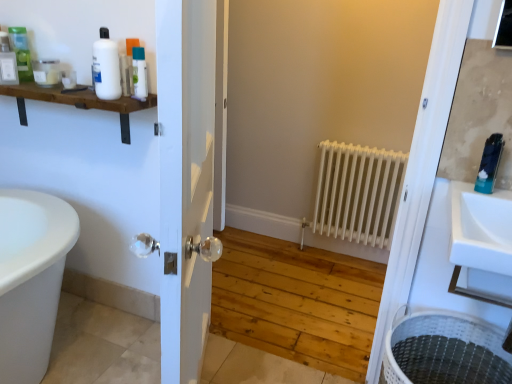
Question: Is matte white jar at upper left, arranged as the 3th toiletry when viewed from the left, positioned with its back to white matte radiator at center?

Choices:
 (A) yes
 (B) no

Answer: (B)

Question: Does matte white jar at upper left, arranged as the 3th toiletry when viewed from the left, appear on the right side of white matte radiator at center?

Choices:
 (A) no
 (B) yes

Answer: (A)

Question: Considering the relative sizes of matte white jar at upper left, which ranks as the 5th toiletry in right-to-left order, and white matte radiator at center in the image provided, is matte white jar at upper left, which ranks as the 5th toiletry in right-to-left order, smaller than white matte radiator at center?

Choices:
 (A) no
 (B) yes

Answer: (B)

Question: Considering the relative sizes of matte white jar at upper left, which ranks as the 5th toiletry in right-to-left order, and white matte radiator at center in the image provided, is matte white jar at upper left, which ranks as the 5th toiletry in right-to-left order, shorter than white matte radiator at center?

Choices:
 (A) yes
 (B) no

Answer: (A)

Question: Is matte white jar at upper left, which ranks as the 5th toiletry in right-to-left order, wider than white matte radiator at center?

Choices:
 (A) no
 (B) yes

Answer: (B)

Question: Is white glossy bottle at upper left, which is the fourth toiletry from right to left, inside the boundaries of matte green bottle at upper left, marked as the second toiletry in a left-to-right arrangement, or outside?

Choices:
 (A) inside
 (B) outside

Answer: (B)

Question: Considering the positions of point (73, 87) and point (24, 41), is point (73, 87) closer or farther from the camera than point (24, 41)?

Choices:
 (A) farther
 (B) closer

Answer: (B)

Question: Is white glossy bottle at upper left, which appears as the 4th toiletry when viewed from the left, wider or thinner than matte green bottle at upper left, which appears as the sixth toiletry when viewed from the right?

Choices:
 (A) wide
 (B) thin

Answer: (B)

Question: Is white glossy bottle at upper left, which appears as the 4th toiletry when viewed from the left, in front of or behind matte green bottle at upper left, which appears as the sixth toiletry when viewed from the right, in the image?

Choices:
 (A) behind
 (B) front

Answer: (B)

Question: Which is correct: white glossy bottle at upper left, which is counted as the third toiletry, starting from the right, is inside white glossy bottle at upper left, which appears as the 4th toiletry when viewed from the left, or outside of it?

Choices:
 (A) inside
 (B) outside

Answer: (B)

Question: Is white glossy bottle at upper left, placed as the fifth toiletry when sorted from left to right, in front of or behind white glossy bottle at upper left, which appears as the 4th toiletry when viewed from the left, in the image?

Choices:
 (A) front
 (B) behind

Answer: (A)

Question: Looking at the image, does white glossy bottle at upper left, placed as the fifth toiletry when sorted from left to right, seem bigger or smaller compared to white glossy bottle at upper left, which is the fourth toiletry from right to left?

Choices:
 (A) small
 (B) big

Answer: (B)

Question: Considering the positions of white glossy bottle at upper left, which is counted as the third toiletry, starting from the right, and white glossy bottle at upper left, which appears as the 4th toiletry when viewed from the left, in the image, is white glossy bottle at upper left, which is counted as the third toiletry, starting from the right, wider or thinner than white glossy bottle at upper left, which appears as the 4th toiletry when viewed from the left,?

Choices:
 (A) thin
 (B) wide

Answer: (B)

Question: Considering the positions of matte white bottle at upper left, marked as the 1th toiletry in a left-to-right arrangement, and matte green bottle at upper left, which appears as the sixth toiletry when viewed from the right, in the image, is matte white bottle at upper left, marked as the 1th toiletry in a left-to-right arrangement, taller or shorter than matte green bottle at upper left, which appears as the sixth toiletry when viewed from the right,?

Choices:
 (A) short
 (B) tall

Answer: (A)

Question: Looking at their shapes, would you say matte white bottle at upper left, marked as the 1th toiletry in a left-to-right arrangement, is wider or thinner than matte green bottle at upper left, which appears as the sixth toiletry when viewed from the right?

Choices:
 (A) wide
 (B) thin

Answer: (B)